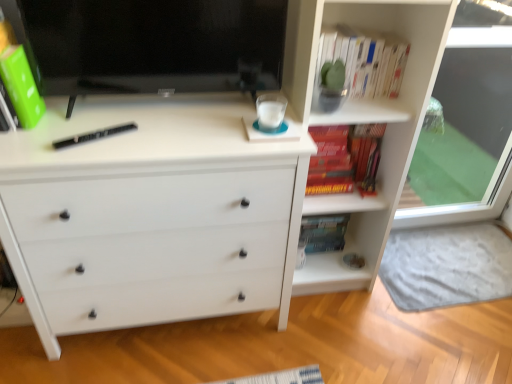
Where is `free location to the right of green matte book at upper left, the first paperback book in the front-to-back sequence`? The height and width of the screenshot is (384, 512). free location to the right of green matte book at upper left, the first paperback book in the front-to-back sequence is located at coordinates (x=69, y=132).